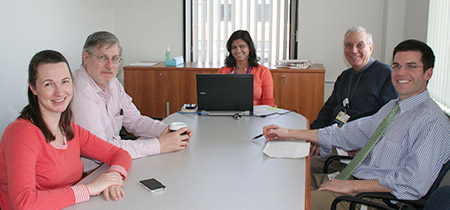
The height and width of the screenshot is (210, 450). In order to click on wood cabinet in this screenshot , I will do `click(178, 80)`.